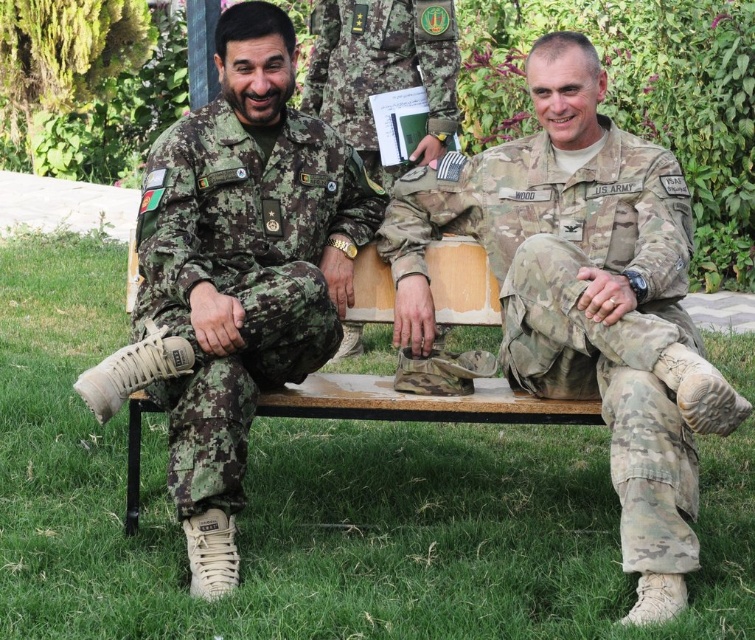
Question: Among these objects, which one is nearest to the camera?

Choices:
 (A) camouflage uniform at center
 (B) camouflage fabric pants at left
 (C) camouflage fabric pants at center

Answer: (C)

Question: Which is nearer to the camouflage uniform at center?

Choices:
 (A) camouflage fabric pants at left
 (B) camouflage fabric pants at center

Answer: (B)

Question: In this image, where is camouflage fabric pants at left located relative to camouflage uniform at center?

Choices:
 (A) above
 (B) below

Answer: (B)

Question: Is the position of camouflage fabric pants at center less distant than that of camouflage fabric pants at left?

Choices:
 (A) yes
 (B) no

Answer: (A)

Question: Among these points, which one is nearest to the camera?

Choices:
 (A) (179, 168)
 (B) (334, 67)
 (C) (632, 196)

Answer: (A)

Question: Is camouflage fabric pants at center positioned in front of camouflage uniform at center?

Choices:
 (A) no
 (B) yes

Answer: (B)